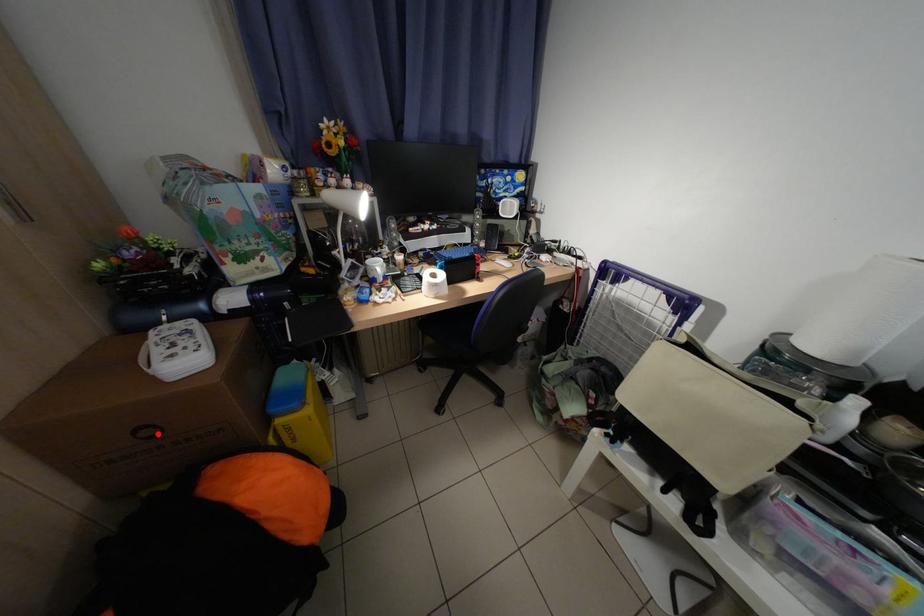
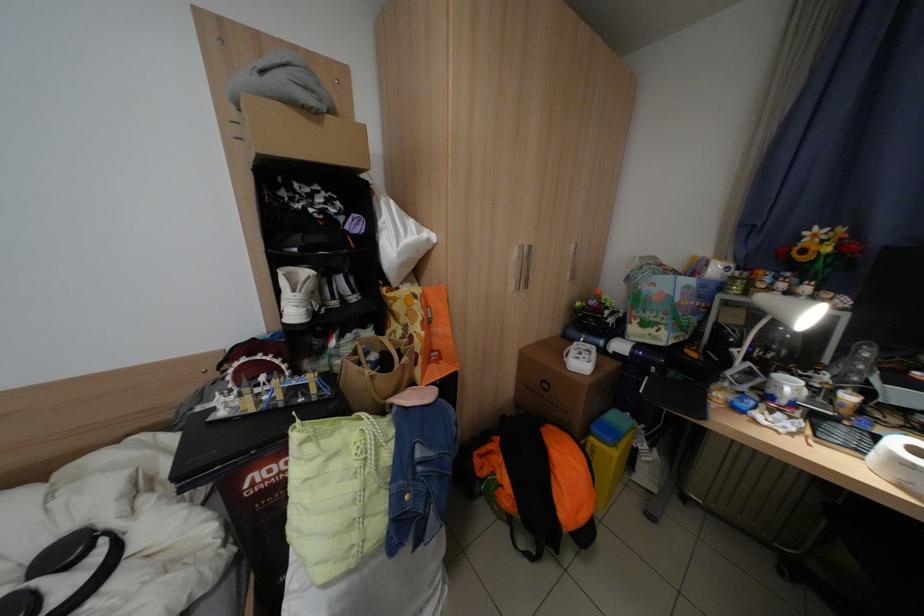
Where in the second image is the point corresponding to the highlighted location from the first image?

(555, 387)